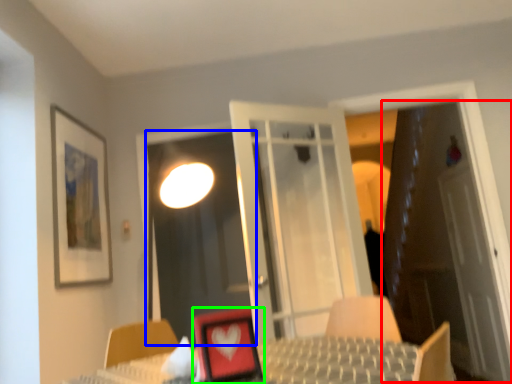
Question: Considering the real-world distances, which object is closest to door (highlighted by a red box)? screen door (highlighted by a blue box) or picture frame (highlighted by a green box).

Choices:
 (A) screen door
 (B) picture frame

Answer: (A)